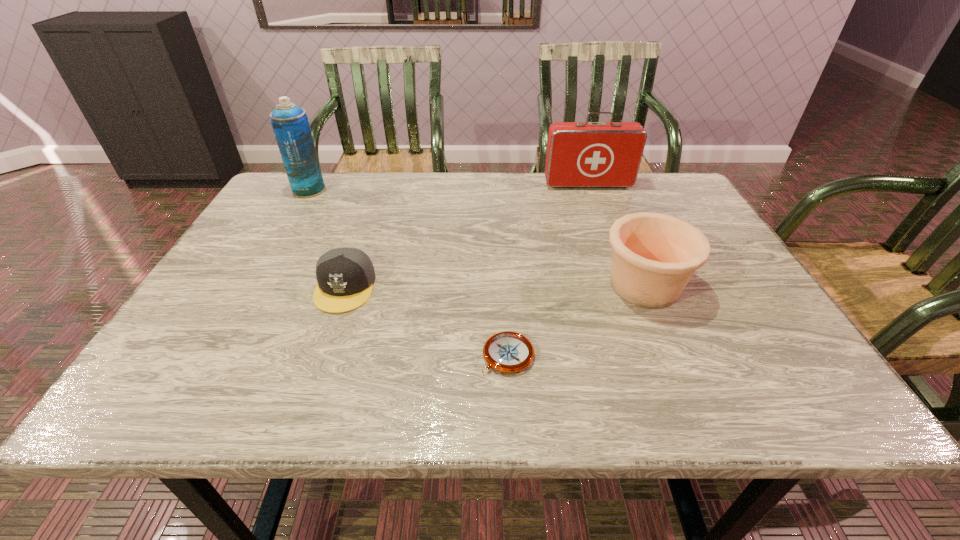
Identify the location of the tallest object. This screenshot has height=540, width=960. coord(290,124).

Find the location of a particular element. aerosol can is located at coordinates (290, 124).

I want to click on the second tallest object, so 579,154.

Find the location of a particular element. the third tallest object is located at coordinates (654, 256).

Locate an element on the screen. Image resolution: width=960 pixels, height=540 pixels. the fourth object from right to left is located at coordinates (345, 276).

The height and width of the screenshot is (540, 960). In order to click on the second shortest object in this screenshot , I will do `click(345, 276)`.

Locate an element on the screen. The width and height of the screenshot is (960, 540). compass is located at coordinates (509, 352).

Locate an element on the screen. The height and width of the screenshot is (540, 960). the third object from left to right is located at coordinates (509, 352).

Where is `free space located 0.130m on the right of the leftmost object`? The width and height of the screenshot is (960, 540). free space located 0.130m on the right of the leftmost object is located at coordinates (370, 190).

This screenshot has height=540, width=960. Find the location of `vacant space located on the side of the first-aid kit with the first aid cross symbol`. vacant space located on the side of the first-aid kit with the first aid cross symbol is located at coordinates (595, 205).